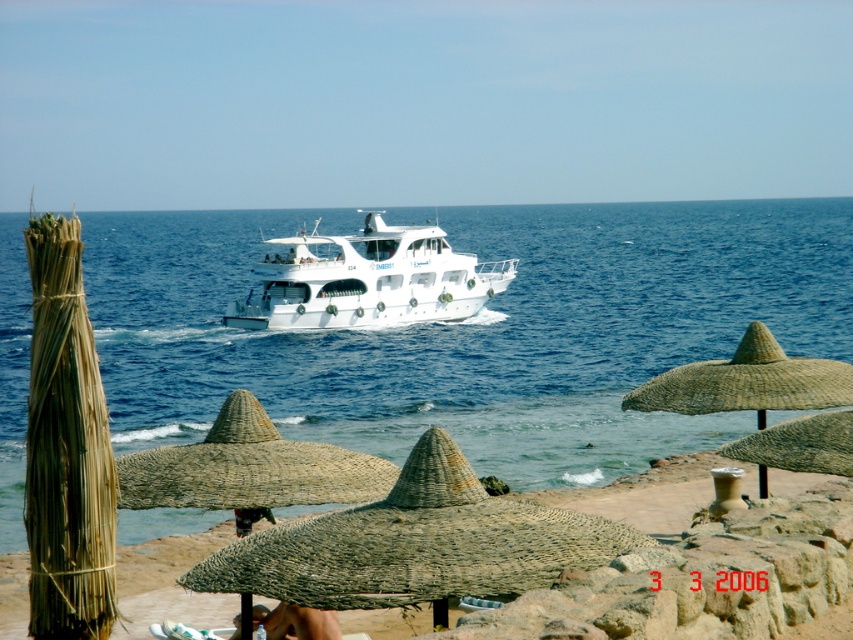
Is brown woven umbrella at center positioned in front of white glossy boat at center?

Yes.

Does brown woven umbrella at center have a lesser height compared to white glossy boat at center?

Correct, brown woven umbrella at center is not as tall as white glossy boat at center.

Image resolution: width=853 pixels, height=640 pixels. I want to click on brown woven umbrella at center, so click(415, 544).

Which is more to the left, brown woven umbrella at center or natural straw umbrella at lower center?

natural straw umbrella at lower center is more to the left.

Who is more forward, [393,563] or [368,483]?

Point [393,563] is in front.

Which is in front, point (566, 563) or point (268, 451)?

Point (566, 563) is more forward.

The image size is (853, 640). What are the coordinates of `brown woven umbrella at center` in the screenshot? It's located at (415, 544).

Does blue water at center have a greater width compared to white glossy boat at center?

Yes.

Does blue water at center come in front of white glossy boat at center?

Yes, blue water at center is closer to the viewer.

Is point (830, 200) more distant than point (337, 243)?

Yes, point (830, 200) is behind point (337, 243).

At what (x,y) coordinates should I click in order to perform the action: click on blue water at center. Please return your answer as a coordinate pair (x, y). Image resolution: width=853 pixels, height=640 pixels. Looking at the image, I should click on (473, 328).